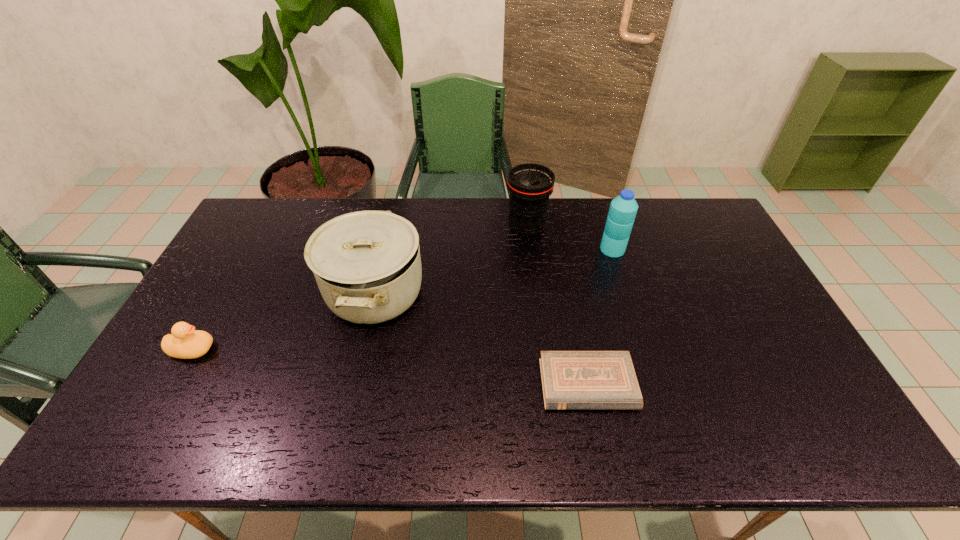
At what (x,y) coordinates should I click in order to perform the action: click on the rightmost object. Please return your answer as a coordinate pair (x, y). This screenshot has width=960, height=540. Looking at the image, I should click on (623, 209).

At what (x,y) coordinates should I click in order to perform the action: click on telephoto lens. Please return your answer as a coordinate pair (x, y). This screenshot has width=960, height=540. Looking at the image, I should click on (530, 185).

This screenshot has height=540, width=960. Find the location of `saucepan`. saucepan is located at coordinates (367, 265).

Find the location of a particular element. The width and height of the screenshot is (960, 540). duck is located at coordinates (185, 342).

Image resolution: width=960 pixels, height=540 pixels. I want to click on the second shortest object, so click(185, 342).

At what (x,y) coordinates should I click in order to perform the action: click on Bible. Please return your answer as a coordinate pair (x, y). This screenshot has width=960, height=540. Looking at the image, I should click on (572, 380).

This screenshot has height=540, width=960. What are the coordinates of `vacant region located 0.180m on the back of the water bottle` in the screenshot? It's located at (600, 210).

Locate an element on the screen. The height and width of the screenshot is (540, 960). free location located on the left of the telephoto lens is located at coordinates (489, 228).

Where is `vacant space situated on the right of the fourth object from right to left`? This screenshot has height=540, width=960. vacant space situated on the right of the fourth object from right to left is located at coordinates (454, 293).

You are a GUI agent. You are given a task and a screenshot of the screen. Output one action in this format:
    pyautogui.click(x=<x>, y=<y>)
    Task: Click on the vacant space located 0.240m on the face of the duck
    The image size is (960, 540).
    Given the screenshot: What is the action you would take?
    pyautogui.click(x=302, y=349)